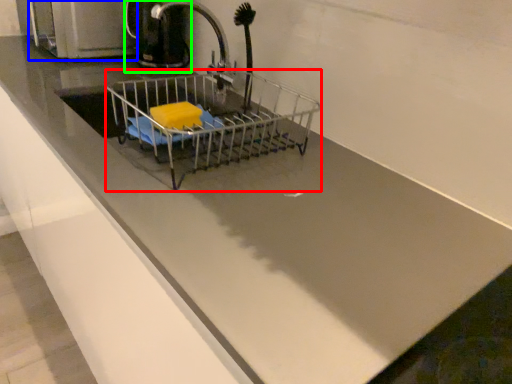
Question: Considering the real-world distances, which object is farthest from shopping cart (highlighted by a red box)? appliance (highlighted by a blue box) or coffeepot (highlighted by a green box)?

Choices:
 (A) appliance
 (B) coffeepot

Answer: (A)